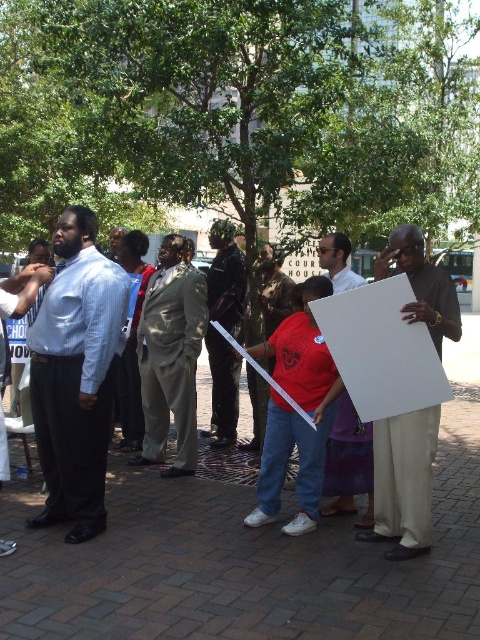
The width and height of the screenshot is (480, 640). What do you see at coordinates (75, 376) in the screenshot?
I see `light blue shirt at left` at bounding box center [75, 376].

Who is lower down, light blue shirt at left or white paper at center?

Positioned lower is white paper at center.

Is point (98, 486) positioned after point (369, 490)?

No.

You are a GUI agent. You are given a task and a screenshot of the screen. Output one action in this format:
    pyautogui.click(x=<x>, y=<y>)
    Task: Click on the light blue shirt at left
    This screenshot has width=480, height=640.
    Given the screenshot: What is the action you would take?
    pyautogui.click(x=75, y=376)

Between light blue shirt at left and matte white sign at right, which one appears on the right side from the viewer's perspective?

Positioned to the right is matte white sign at right.

Is light blue shirt at left below matte white sign at right?

No.

Is point (31, 397) in front of point (396, 536)?

No, it is not.

Image resolution: width=480 pixels, height=640 pixels. What are the coordinates of `light blue shirt at left` in the screenshot? It's located at (75, 376).

Is point (195, 397) closer to camera compared to point (354, 492)?

No, (195, 397) is behind (354, 492).

Can you confirm if light gray suit at center is positioned to the left of white paper at center?

Indeed, light gray suit at center is positioned on the left side of white paper at center.

Which is behind, point (170, 288) or point (348, 422)?

Positioned behind is point (170, 288).

Locate an element on the screen. This screenshot has height=640, width=480. light gray suit at center is located at coordinates (170, 355).